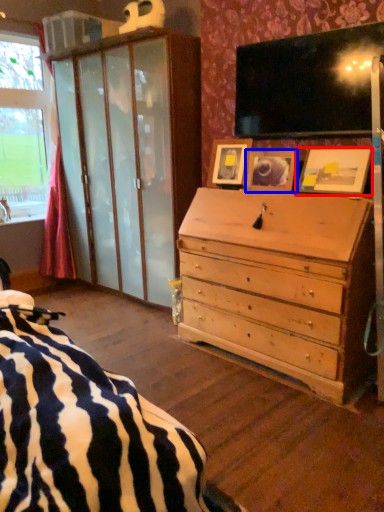
Question: Which object is further to the camera taking this photo, picture frame (highlighted by a red box) or picture frame (highlighted by a blue box)?

Choices:
 (A) picture frame
 (B) picture frame

Answer: (B)